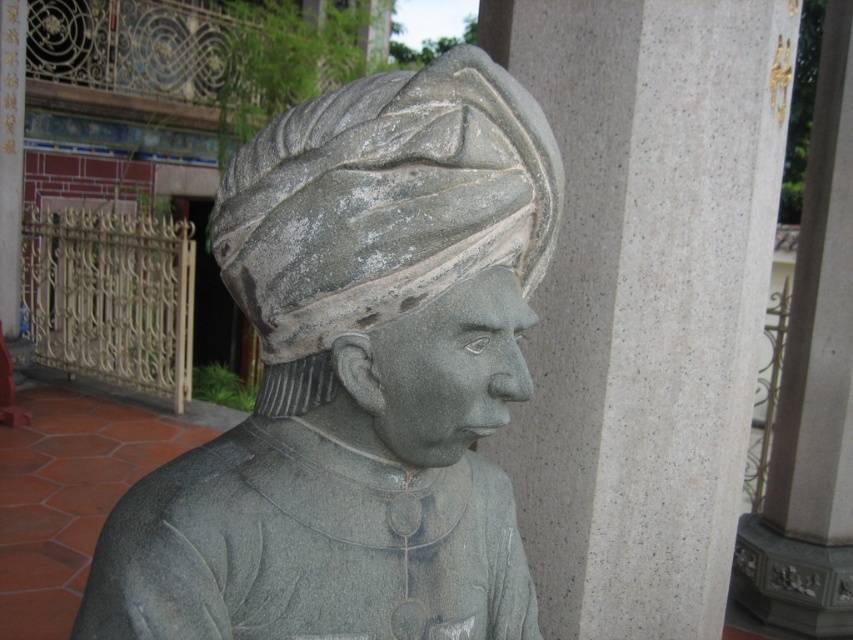
Is point (465, 243) more distant than point (726, 509)?

No, it is not.

Describe the element at coordinates (358, 378) in the screenshot. This screenshot has width=853, height=640. I see `gray stone statue at center` at that location.

Identify the location of gray stone statue at center. (358, 378).

Which of these two, gray stone statue at center or gray stone headscarf at center, stands shorter?

With less height is gray stone headscarf at center.

Between point (379, 168) and point (257, 212), which one is positioned in front?

Point (379, 168) is more forward.

Image resolution: width=853 pixels, height=640 pixels. What are the coordinates of `gray stone statue at center` in the screenshot? It's located at (358, 378).

Does gray stone pillar at center-right have a larger size compared to gray stone headscarf at center?

Indeed, gray stone pillar at center-right has a larger size compared to gray stone headscarf at center.

Who is positioned more to the right, gray stone pillar at center-right or gray stone headscarf at center?

gray stone pillar at center-right is more to the right.

The height and width of the screenshot is (640, 853). Describe the element at coordinates (645, 300) in the screenshot. I see `gray stone pillar at center-right` at that location.

This screenshot has height=640, width=853. Identify the location of gray stone pillar at center-right. (645, 300).